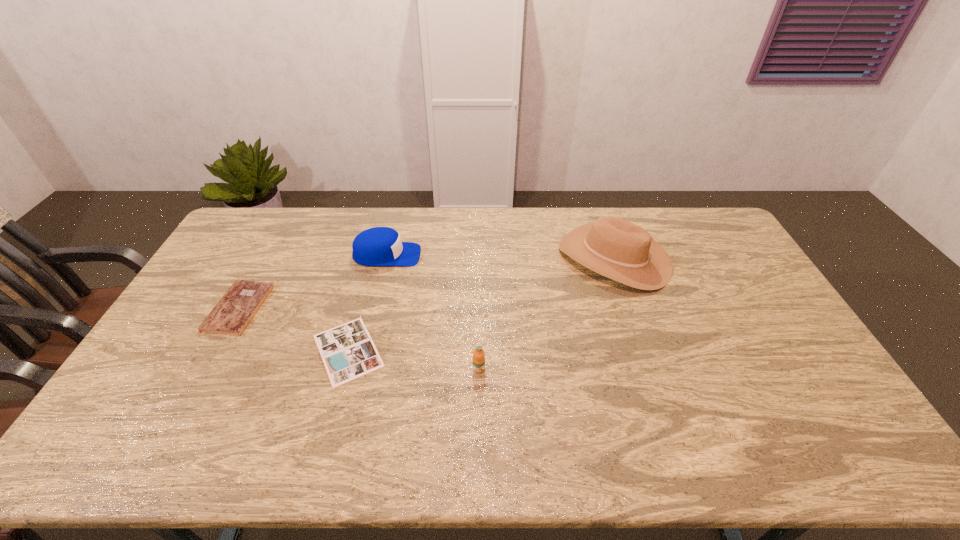
At what (x,y) coordinates should I click in order to perform the action: click on vacant point located between the baseball cap and the rightmost object. Please return your answer as a coordinate pair (x, y). The image size is (960, 540). Looking at the image, I should click on (500, 256).

Image resolution: width=960 pixels, height=540 pixels. I want to click on free space between the baseball cap and the second shortest object, so click(313, 282).

Identify the location of free space between the cowboy hat and the fourth object from left to right. The width and height of the screenshot is (960, 540). (546, 314).

This screenshot has height=540, width=960. I want to click on free space between the shortest object and the Bible, so click(294, 329).

Find the location of a particular element. empty location between the rightmost object and the shortest object is located at coordinates (481, 304).

Locate an element on the screen. This screenshot has width=960, height=540. vacant area that lies between the baseball cap and the Bible is located at coordinates (313, 282).

Identify the location of free space between the second object from right to left and the book. (414, 360).

Find the location of a particular element. This screenshot has height=540, width=960. free space between the shortest object and the Bible is located at coordinates (294, 329).

Where is `free space between the baseball cap and the book`? The image size is (960, 540). free space between the baseball cap and the book is located at coordinates (368, 303).

At what (x,y) coordinates should I click in order to perform the action: click on the fourth closest object to the baseball cap. Please return your answer as a coordinate pair (x, y). Looking at the image, I should click on (611, 246).